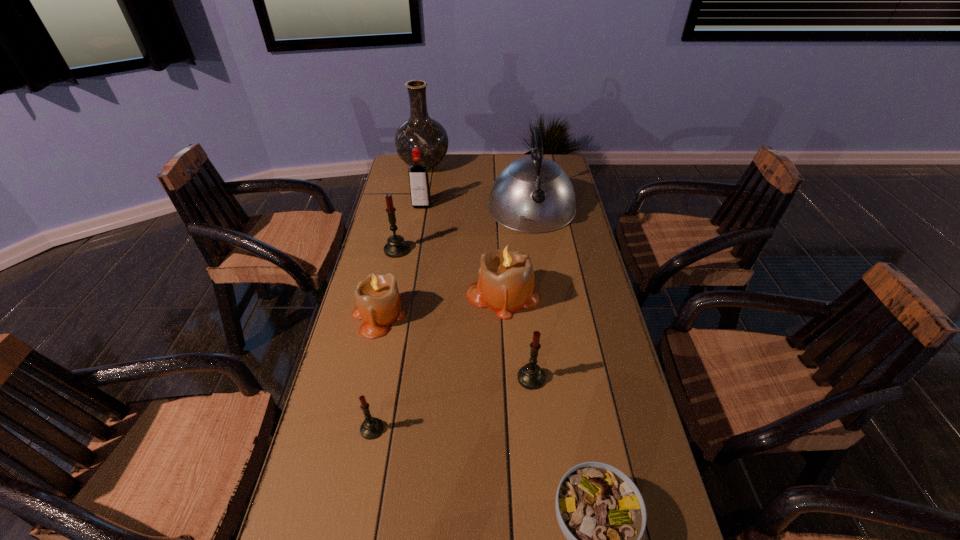
This screenshot has height=540, width=960. Identify the location of vase that is at the left edge. (420, 131).

This screenshot has height=540, width=960. I want to click on vodka that is at the left edge, so click(418, 175).

At what (x,y) coordinates should I click in order to perform the action: click on object that is at the right edge. Please return your answer as a coordinate pair (x, y). This screenshot has width=960, height=540. Looking at the image, I should click on (533, 194).

Locate an element on the screen. object at the far left corner is located at coordinates (420, 131).

The height and width of the screenshot is (540, 960). In the image, there is a desktop. Identify the location of vacant area at the far edge. (436, 176).

At what (x,y) coordinates should I click in order to perform the action: click on free space at the left edge of the desktop. Please return your answer as a coordinate pair (x, y). The height and width of the screenshot is (540, 960). Looking at the image, I should click on (402, 200).

Image resolution: width=960 pixels, height=540 pixels. In the image, there is a desktop. Find the location of `vacant region at the right edge`. vacant region at the right edge is located at coordinates (613, 399).

Image resolution: width=960 pixels, height=540 pixels. In order to click on vacant space that's between the third nearest object and the farthest object in this screenshot , I will do `click(477, 272)`.

Find the location of `vacant area that lies between the left beige candle and the seventh farthest object`. vacant area that lies between the left beige candle and the seventh farthest object is located at coordinates (455, 347).

Where is `free space between the right beige candle and the farthest red candle`? Image resolution: width=960 pixels, height=540 pixels. free space between the right beige candle and the farthest red candle is located at coordinates (449, 273).